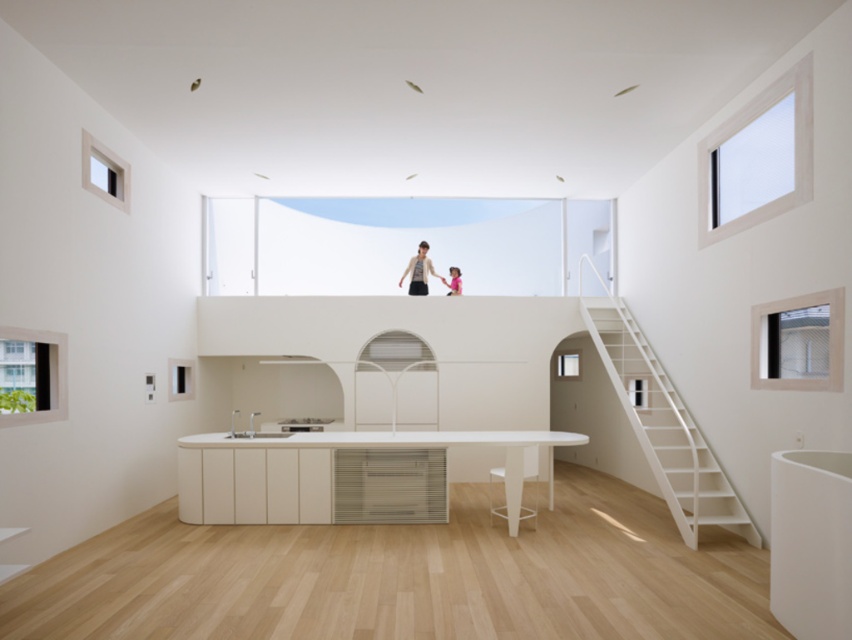
Is point (427, 288) less distant than point (450, 292)?

That is True.

You are a GUI agent. You are given a task and a screenshot of the screen. Output one action in this format:
    pyautogui.click(x=<x>, y=<y>)
    Task: Click on the matte white shirt at upper center
    
    Given the screenshot: What is the action you would take?
    pyautogui.click(x=418, y=272)

Between white wooden staircase at right and white glossy stool at lower center, which one appears on the right side from the viewer's perspective?

From the viewer's perspective, white wooden staircase at right appears more on the right side.

Which is in front, point (665, 412) or point (488, 500)?

Point (488, 500)

Find the location of a particular element. This screenshot has width=852, height=640. white wooden staircase at right is located at coordinates (663, 426).

Can you confirm if white matte hardwood at center is positioned above pink fabric at upper center?

Incorrect, white matte hardwood at center is not positioned above pink fabric at upper center.

Looking at this image, can you confirm if white matte hardwood at center is shorter than pink fabric at upper center?

Incorrect, white matte hardwood at center's height does not fall short of pink fabric at upper center's.

Is point (302, 458) farther from viewer compared to point (456, 289)?

No.

Where is `white matte hardwood at center`? white matte hardwood at center is located at coordinates (320, 470).